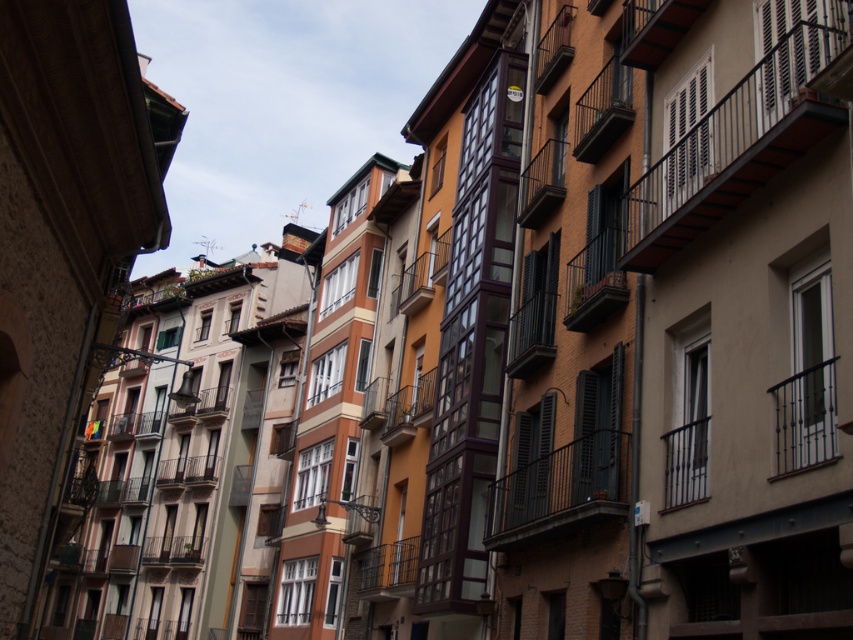
Measure the distance between metallic black balcony at upper right and wooden brown balcony at center.

metallic black balcony at upper right and wooden brown balcony at center are 10.00 meters apart from each other.

Does point (795, 38) come behind point (596, 486)?

No.

I want to click on metallic black balcony at upper right, so click(735, 141).

Who is shorter, metallic black balcony at center or wooden balcony at center?

Standing shorter between the two is metallic black balcony at center.

Does metallic black balcony at center have a greater width compared to wooden balcony at center?

In fact, metallic black balcony at center might be narrower than wooden balcony at center.

Between point (527, 180) and point (160, 420), which one is positioned in front?

Positioned in front is point (527, 180).

Where is `metallic black balcony at center`? metallic black balcony at center is located at coordinates [541, 182].

Does point (622, 493) come in front of point (540, 179)?

Yes.

Who is positioned more to the right, wooden brown balcony at center or metallic black balcony at center?

Positioned to the right is metallic black balcony at center.

Where is `wooden brown balcony at center`? The height and width of the screenshot is (640, 853). wooden brown balcony at center is located at coordinates (560, 490).

Locate an element on the screen. wooden brown balcony at center is located at coordinates (560, 490).